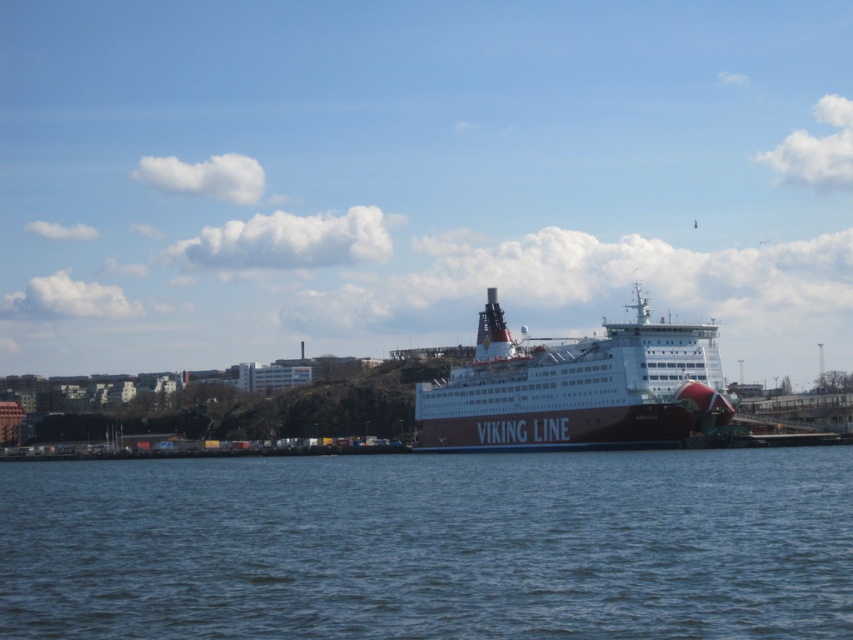
You are a drone operator planning to fly a drone from the blue water at center to the dark blue metallic ferry at center. Based on the scene description, which direction should you fly the drone to reach the ferry?

The dark blue metallic ferry at center is positioned at the center of the image, so the drone should fly towards the center from the blue water at center.

You are standing at the port and want to board the Viking Line ferry. The blue water at center is where the ferry is docked. If you need to reach the ferry within 10 seconds, and you can walk at 1.5 meters per second, will you make it?

The blue water at center is 41.23 meters from viewer. Since you walk at 1.5 meters per second, you would need 41.23 divided by 1.5, which is approximately 27.5 seconds. Therefore, you will not make it in 10 seconds.